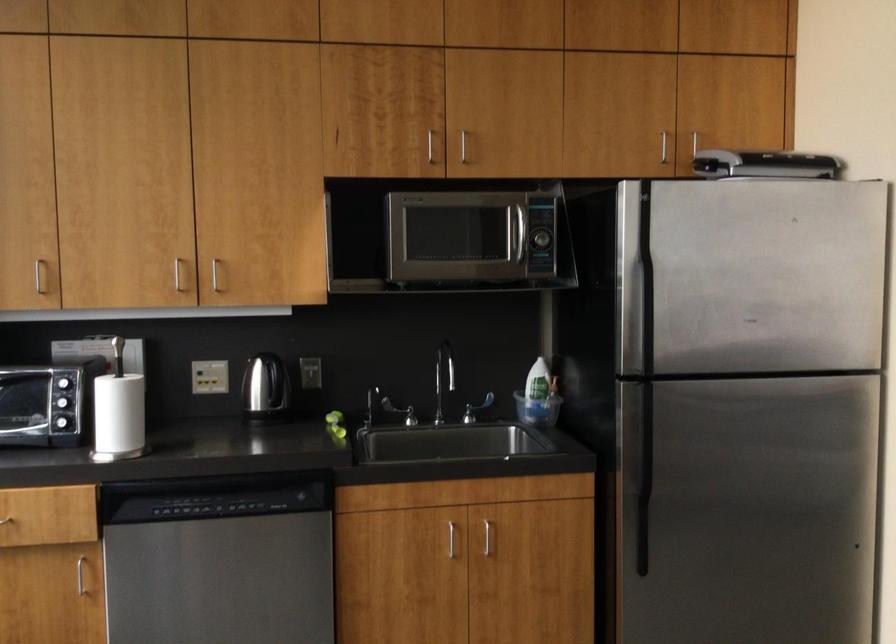
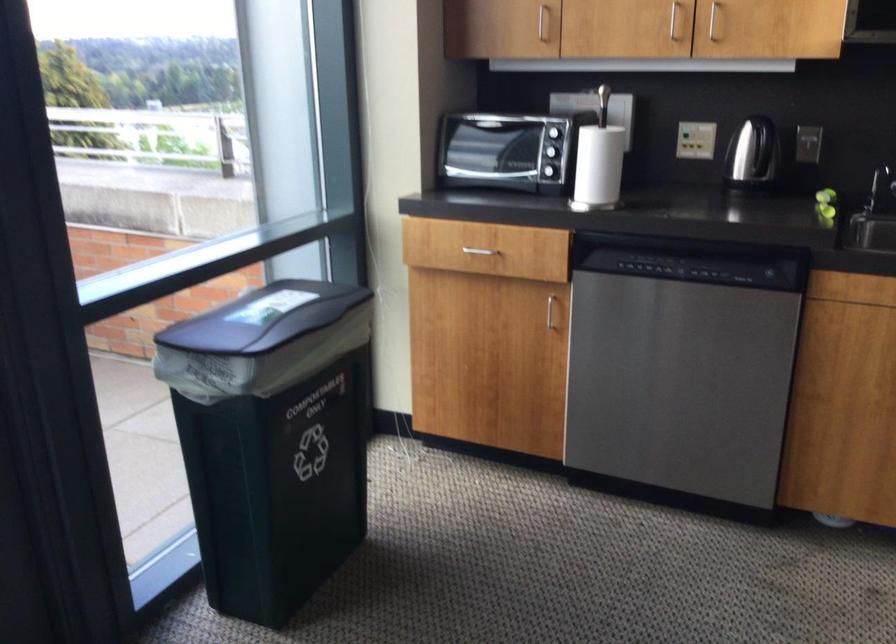
Where in the second image is the point corresponding to (133,413) from the first image?

(599, 165)